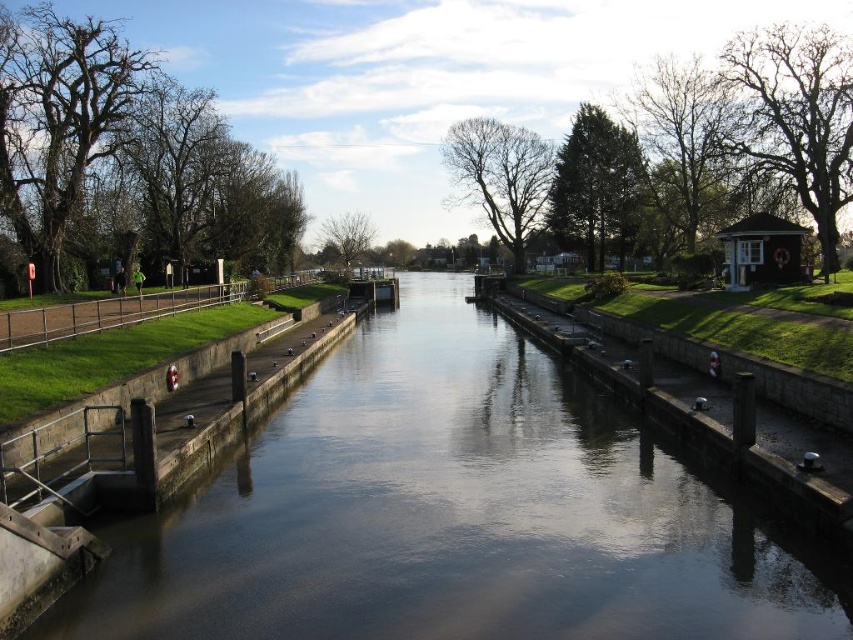
You are standing at the edge of the canal and want to determine which of the two points, point (38, 22) or point (459, 186), is nearer to you. Based on the scene, which point is closer?

Point (38, 22) is closer to the viewer than point (459, 186).

You are an artist sketching the canal scene. You notice two sets of branches in the image. Which set, the bare branches at left or the bare branches at center, appears thicker in your sketch?

The bare branches at left might be wider than the bare branches at center, so they would appear thicker in your sketch.

You are standing at the edge of the canal and see two points marked on the image. Which point, point (833, 113) or point (503, 136), is closer to you?

Point (833, 113) is closer to the camera than point (503, 136), so the point closer to you is point (833, 113).